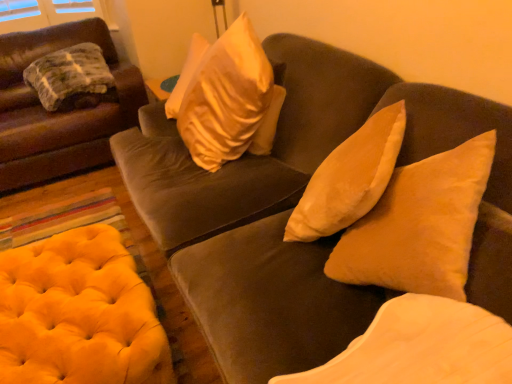
Question: Can you confirm if velvet brown couch at center, the 1th studio couch in the right-to-left sequence, is smaller than green textured blanket at left, which is the third pillow in front-to-back order?

Choices:
 (A) no
 (B) yes

Answer: (A)

Question: Is velvet brown couch at center, the 1th studio couch in the right-to-left sequence, shorter than green textured blanket at left, the 1th pillow from the back?

Choices:
 (A) yes
 (B) no

Answer: (B)

Question: Is velvet brown couch at center, the 1th studio couch in the right-to-left sequence, oriented towards green textured blanket at left, the 1th pillow from the back?

Choices:
 (A) yes
 (B) no

Answer: (B)

Question: Does velvet brown couch at center, the 1th studio couch in the right-to-left sequence, come in front of green textured blanket at left, the first pillow viewed from the left?

Choices:
 (A) yes
 (B) no

Answer: (A)

Question: Can you confirm if velvet brown couch at center, the 1th studio couch in the right-to-left sequence, is positioned to the left of green textured blanket at left, positioned as the 1th pillow in top-to-bottom order?

Choices:
 (A) no
 (B) yes

Answer: (A)

Question: Can green textured blanket at left, positioned as the 1th pillow in top-to-bottom order, be found inside velvet brown couch at center, the 2th studio couch when ordered from left to right?

Choices:
 (A) no
 (B) yes

Answer: (A)

Question: Considering the relative sizes of velvet beige pillow at center, the first pillow from the front, and velvet brown couch at left, the first studio couch in the left-to-right sequence, in the image provided, is velvet beige pillow at center, the first pillow from the front, thinner than velvet brown couch at left, the first studio couch in the left-to-right sequence,?

Choices:
 (A) yes
 (B) no

Answer: (A)

Question: Can you confirm if velvet beige pillow at center, the 2th pillow viewed from the right, is wider than velvet brown couch at left, the first studio couch in the left-to-right sequence?

Choices:
 (A) yes
 (B) no

Answer: (B)

Question: Is velvet beige pillow at center, positioned as the 1th pillow in bottom-to-top order, placed right next to velvet brown couch at left, placed as the 2th studio couch when sorted from right to left?

Choices:
 (A) no
 (B) yes

Answer: (A)

Question: From the image's perspective, is velvet beige pillow at center, the first pillow from the front, over velvet brown couch at left, the first studio couch in the left-to-right sequence?

Choices:
 (A) no
 (B) yes

Answer: (A)

Question: Is velvet brown couch at left, the first studio couch in the left-to-right sequence, a part of velvet beige pillow at center, the 3th pillow in the top-to-bottom sequence?

Choices:
 (A) yes
 (B) no

Answer: (B)

Question: Is velvet beige pillow at center, the first pillow from the front, behind velvet brown couch at left, placed as the 2th studio couch when sorted from right to left?

Choices:
 (A) yes
 (B) no

Answer: (B)

Question: Is velvet beige pillow at center, which is counted as the 3th pillow, starting from the back, next to yellow tufted ottoman at lower left?

Choices:
 (A) yes
 (B) no

Answer: (B)